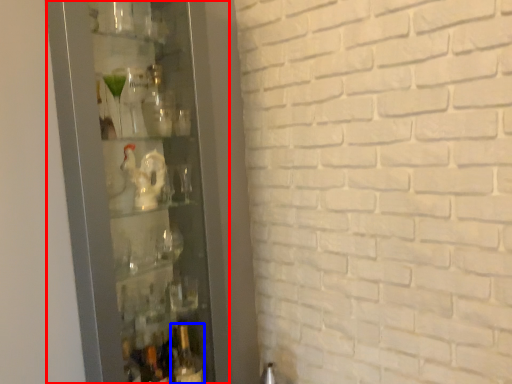
Question: Which object appears closest to the camera in this image, glass door (highlighted by a red box) or bottle (highlighted by a blue box)?

Choices:
 (A) glass door
 (B) bottle

Answer: (A)